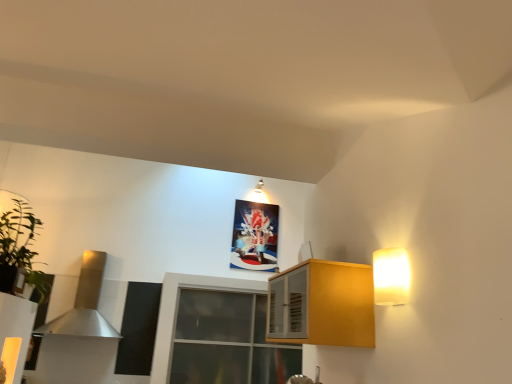
Question: From a real-world perspective, relative to green leafy plant at left, is transparent glass window at center vertically above or below?

Choices:
 (A) above
 (B) below

Answer: (B)

Question: From the image's perspective, is transparent glass window at center located above or below green leafy plant at left?

Choices:
 (A) above
 (B) below

Answer: (B)

Question: Which object is positioned farthest from the satin gold exhaust hood at left?

Choices:
 (A) white glossy light fixture at upper center, which appears as the 1th light fixture when viewed from the back
 (B) green leafy plant at left
 (C) yellow matte cabinet at right
 (D) warm matte wall sconce at upper right, which ranks as the 1th light fixture in right-to-left order
 (E) transparent glass window at center

Answer: (D)

Question: Estimate the real-world distances between objects in this image. Which object is farther from the transparent glass window at center?

Choices:
 (A) matte plastic picture frame at upper center
 (B) green leafy plant at left
 (C) white glossy light fixture at upper center, arranged as the 2th light fixture when ordered from the bottom
 (D) yellow matte cabinet at right
 (E) warm matte wall sconce at upper right, which is the 1th light fixture from front to back

Answer: (E)